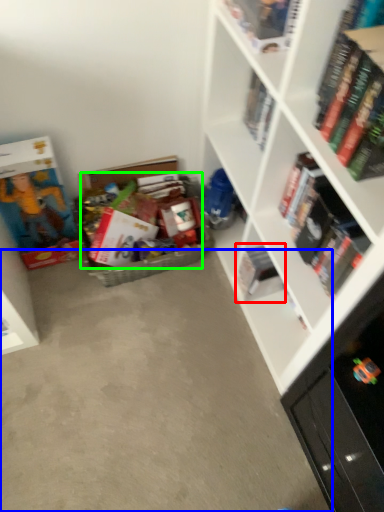
Question: Based on their relative distances, which object is farther from book (highlighted by a red box)? Choose from concrete (highlighted by a blue box) and book (highlighted by a green box).

Choices:
 (A) concrete
 (B) book

Answer: (A)